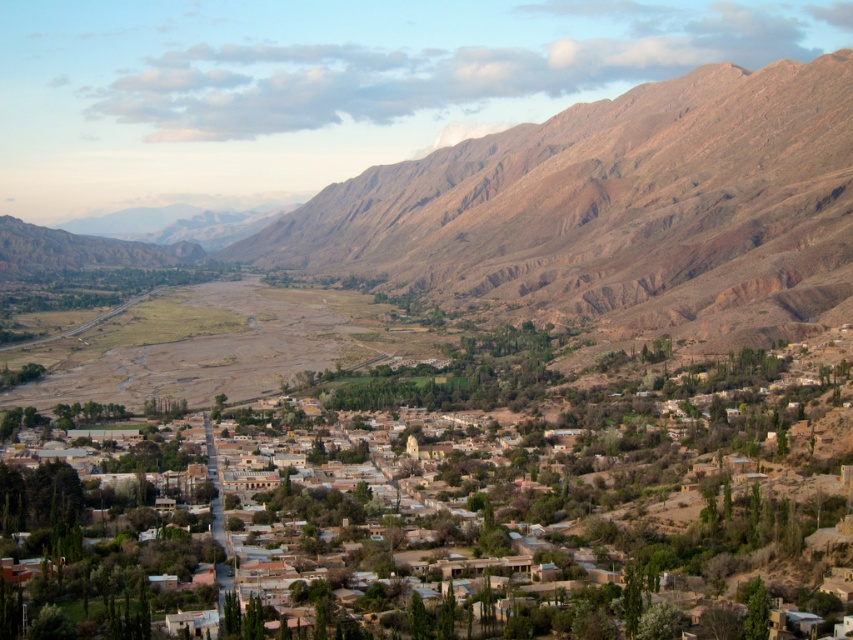
You are a hiker standing at the edge of the valley looking towards the town. You notice the brown clay houses at center and the brown rocky mountain at center. Which of these two landmarks is closer to you?

The brown clay houses at center are closer to you since they are positioned in front of the brown rocky mountain at center.

You are a hiker standing at the edge of the town and want to reach the brown rocky mountain at center. The path you want to take goes directly past the brown clay houses at center. If your backpack can only carry enough supplies for a 400 feet hike, will you have enough supplies to reach the mountain?

The brown clay houses at center and brown rocky mountain at center are 478.71 feet apart. Since your backpack can only carry enough supplies for 400 feet, you do not have enough supplies to reach the mountain.